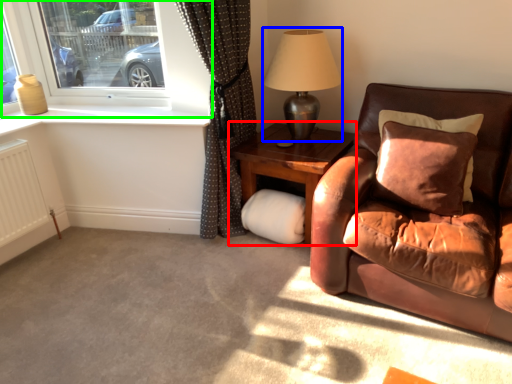
Question: Considering the real-world distances, which object is farthest from table (highlighted by a red box)? table lamp (highlighted by a blue box) or window (highlighted by a green box)?

Choices:
 (A) table lamp
 (B) window

Answer: (B)